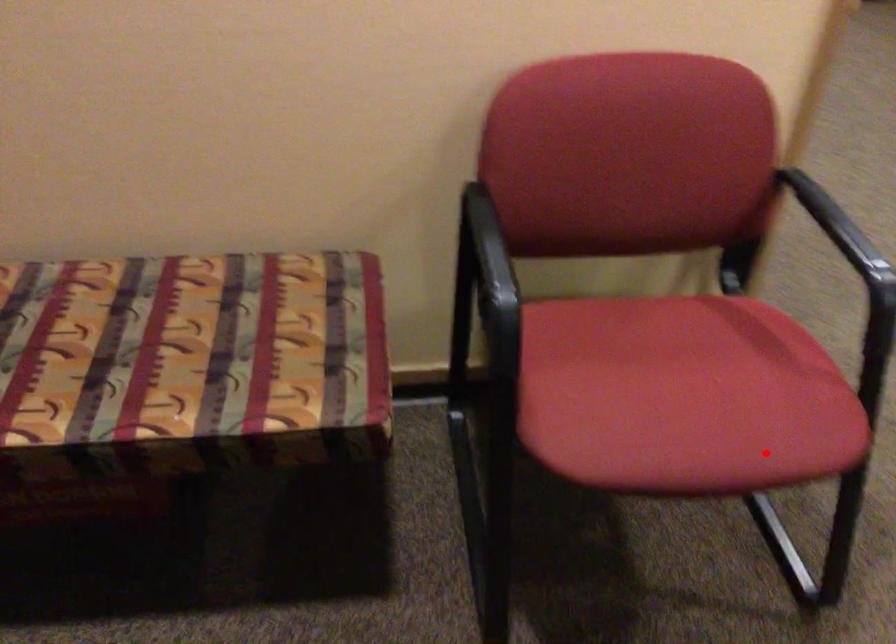
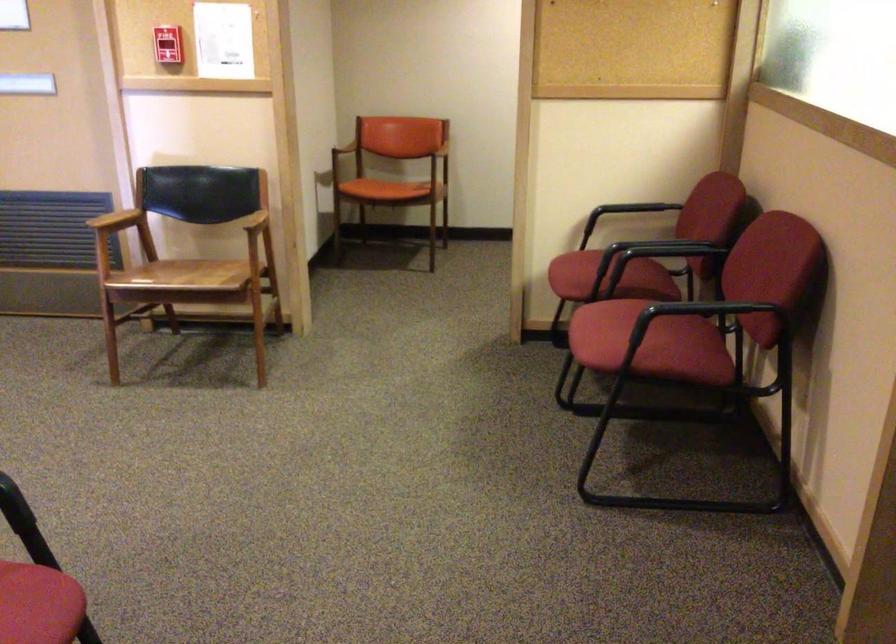
In the second image, find the point that corresponds to the highlighted location in the first image.

(39, 605)